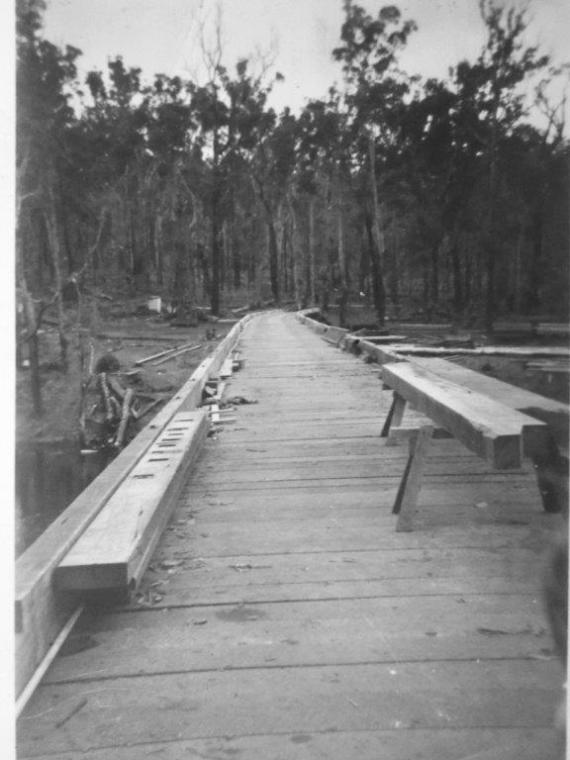
Where is `wooden plank`? The image size is (570, 760). wooden plank is located at coordinates (508, 445).